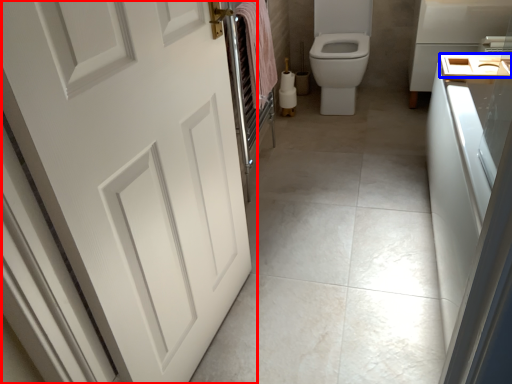
Question: Among these objects, which one is farthest to the camera, door (highlighted by a red box) or sink (highlighted by a blue box)?

Choices:
 (A) door
 (B) sink

Answer: (B)